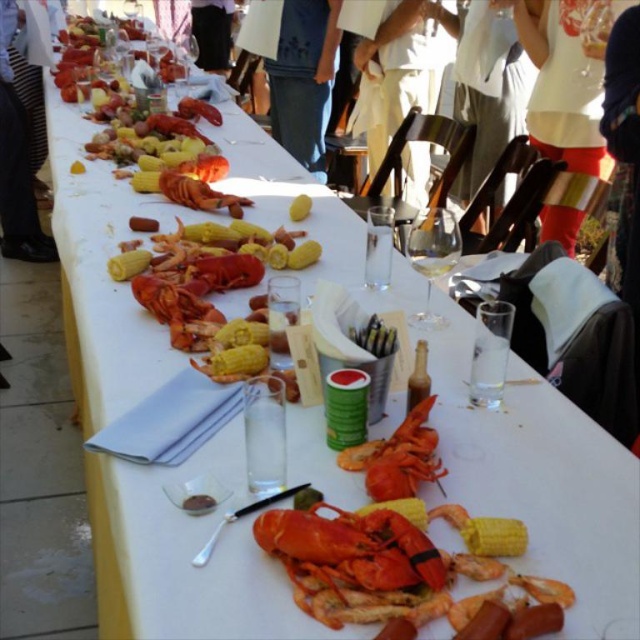
Does striped fabric pants at left appear on the left side of black fabric pants at upper center?

Yes, striped fabric pants at left is to the left of black fabric pants at upper center.

Who is taller, striped fabric pants at left or black fabric pants at upper center?

Standing taller between the two is striped fabric pants at left.

Which is in front, point (4, 122) or point (198, 42)?

Point (4, 122)

Locate an element on the screen. striped fabric pants at left is located at coordinates (17, 161).

Does striped fabric pants at left have a lesser height compared to orange lobster at center?

Incorrect, striped fabric pants at left's height does not fall short of orange lobster at center's.

Describe the element at coordinates (17, 161) in the screenshot. I see `striped fabric pants at left` at that location.

Between point (1, 61) and point (381, 497), which one is positioned behind?

The point (1, 61) is behind.

You are a GUI agent. You are given a task and a screenshot of the screen. Output one action in this format:
    pyautogui.click(x=<x>, y=<y>)
    Task: Click on the striped fabric pants at left
    This screenshot has height=640, width=640.
    Given the screenshot: What is the action you would take?
    pyautogui.click(x=17, y=161)

Is point (449, 211) more distant than point (192, 20)?

No, (449, 211) is in front of (192, 20).

Can you confirm if clear glass wine glass at center is positioned to the left of black fabric pants at upper center?

No, clear glass wine glass at center is not to the left of black fabric pants at upper center.

Is point (449, 236) closer to camera compared to point (225, 12)?

Yes.

Image resolution: width=640 pixels, height=640 pixels. I want to click on clear glass wine glass at center, so click(x=433, y=256).